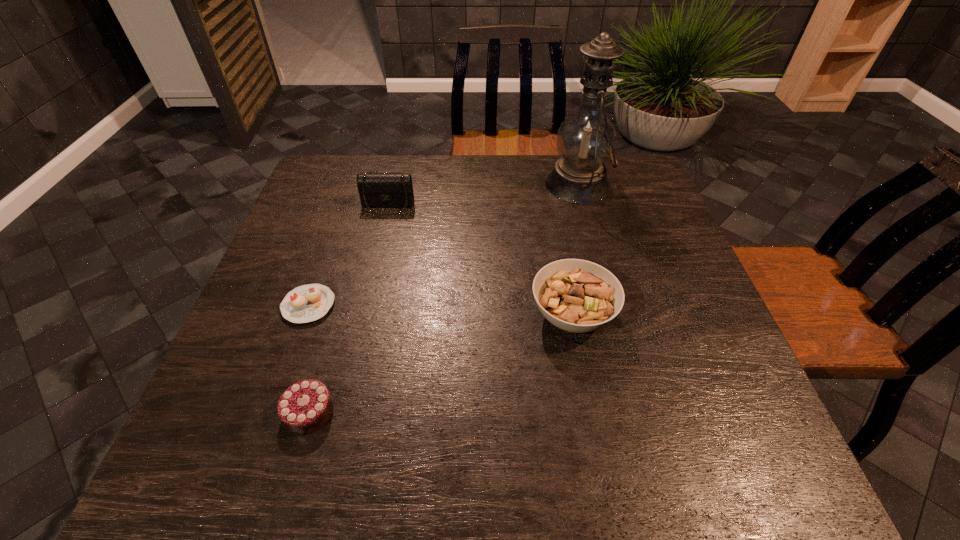
Locate an element on the screen. The height and width of the screenshot is (540, 960). vacant area that lies between the tallest object and the chocolate cake is located at coordinates (444, 298).

Identify the location of empty space that is in between the stew and the clutch bag. This screenshot has height=540, width=960. (480, 260).

This screenshot has height=540, width=960. In order to click on blank region between the stew and the tallest object in this screenshot , I will do `click(575, 250)`.

Image resolution: width=960 pixels, height=540 pixels. Find the location of `vacant region between the stew and the cupcake`. vacant region between the stew and the cupcake is located at coordinates (441, 310).

This screenshot has height=540, width=960. In order to click on the second closest object relative to the clutch bag in this screenshot , I will do `click(586, 139)`.

In order to click on object that is the fourth closest to the tallest object in this screenshot , I will do `click(306, 406)`.

Image resolution: width=960 pixels, height=540 pixels. In order to click on vacant position in the image that satisfies the following two spatial constraints: 1. on the back side of the oil lamp; 2. on the left side of the cupcake in this screenshot , I will do `click(351, 184)`.